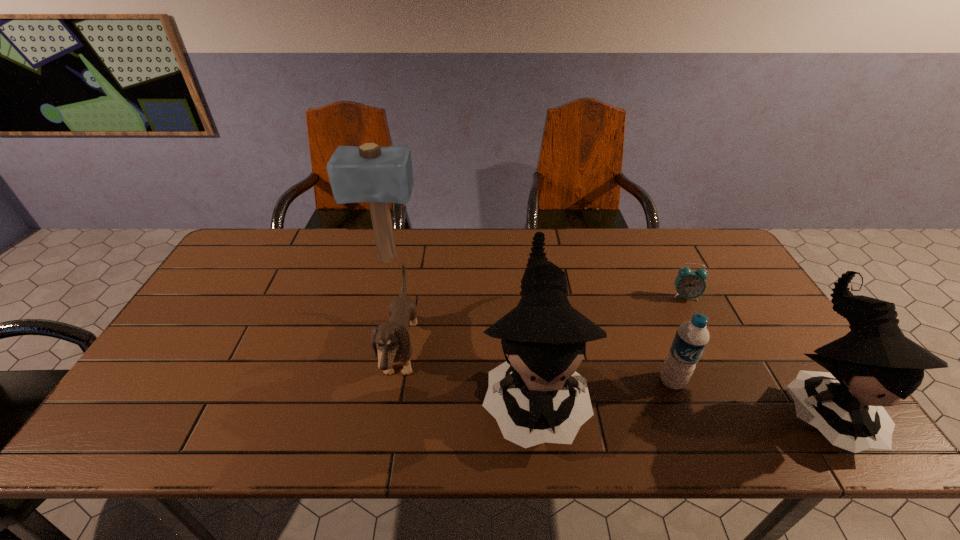
At what (x,y) coordinates should I click in order to perform the action: click on the fourth object from right to left. Please return your answer as a coordinate pair (x, y). The width and height of the screenshot is (960, 540). Looking at the image, I should click on (531, 395).

Locate an element on the screen. This screenshot has height=540, width=960. the left doll is located at coordinates (531, 395).

In order to click on the rightmost object in this screenshot , I will do `click(874, 365)`.

Identify the location of the shorter doll. Image resolution: width=960 pixels, height=540 pixels. (874, 365).

Find the location of `the farthest object`. the farthest object is located at coordinates (369, 173).

Where is `the fifth nearest object`? The width and height of the screenshot is (960, 540). the fifth nearest object is located at coordinates (689, 284).

You are a GUI agent. You are given a task and a screenshot of the screen. Output one action in this format:
    pyautogui.click(x=<x>, y=<y>)
    Task: Click on the fifth object from left to right
    This screenshot has height=540, width=960.
    Given the screenshot: What is the action you would take?
    pyautogui.click(x=689, y=284)

You are a GUI agent. You are given a task and a screenshot of the screen. Output one action in this format:
    pyautogui.click(x=<x>, y=<y>)
    Task: Click on the water bottle
    This screenshot has width=960, height=540.
    Given the screenshot: What is the action you would take?
    pyautogui.click(x=692, y=337)

Locate an element on the screen. The image size is (960, 540). the fourth object from left to right is located at coordinates (692, 337).

At what (x,y) coordinates should I click in order to perform the action: click on the fifth tallest object. Please return your answer as a coordinate pair (x, y). Looking at the image, I should click on (392, 339).